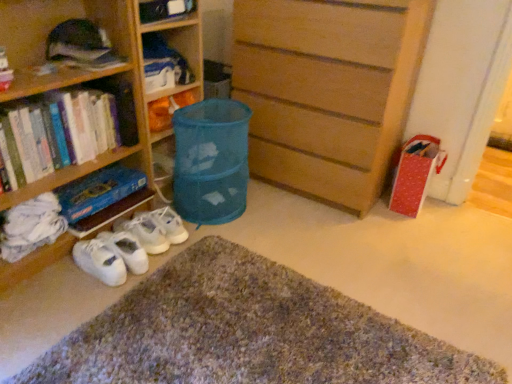
At what (x,y) coordinates should I click in order to perform the action: click on vacant area that lies in front of wooden chest of drawers at center. Please return your answer as a coordinate pair (x, y). This screenshot has height=384, width=512. Looking at the image, I should click on point(332,240).